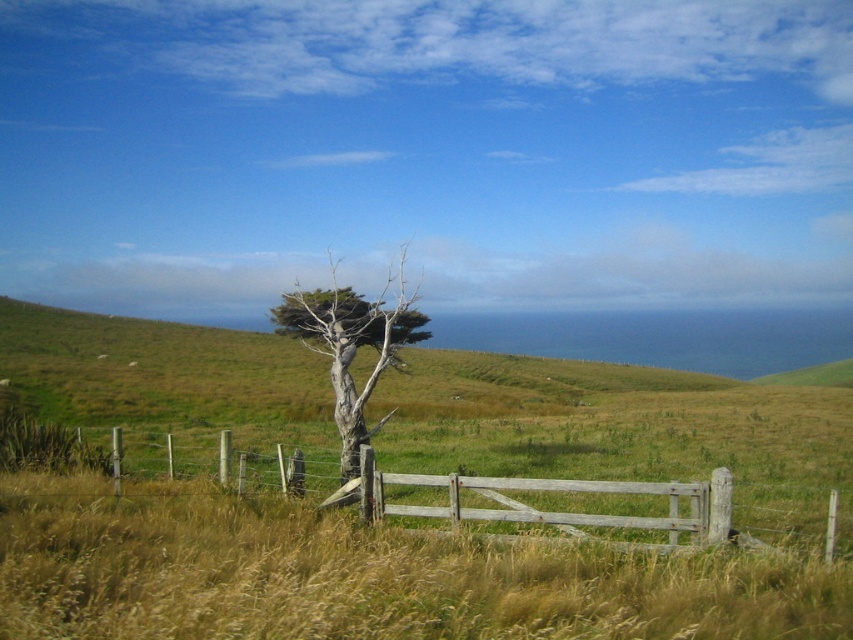
structural integrity of the weathered wood gate at center and gray textured tree at center is a concern. Which one is more likely to be stable in a strong wind?

structural integrity of the weathered wood gate at center and gray textured tree at center is a concern. The weathered wood gate at center is in front of gray textured tree at center, so the gray textured tree at center is more likely to be stable in a strong wind because it is behind and possibly anchored more firmly into the ground.

You are standing at the center of the grassy field and want to exit through the weathered wood gate at center. In which direction should you walk to reach the gate?

You should walk towards the point at coordinates (654, 513) to reach the weathered wood gate at center.

You are a hiker who wants to take a photo of the gray textured tree at center and the weathered wood gate at center. Which object should you stand to the left of to capture both in the frame?

You should stand to the left of the gray textured tree at center because the weathered wood gate at center is on the right side of the gray textured tree at center, so positioning yourself to the left of the tree will allow both objects to be in the frame.